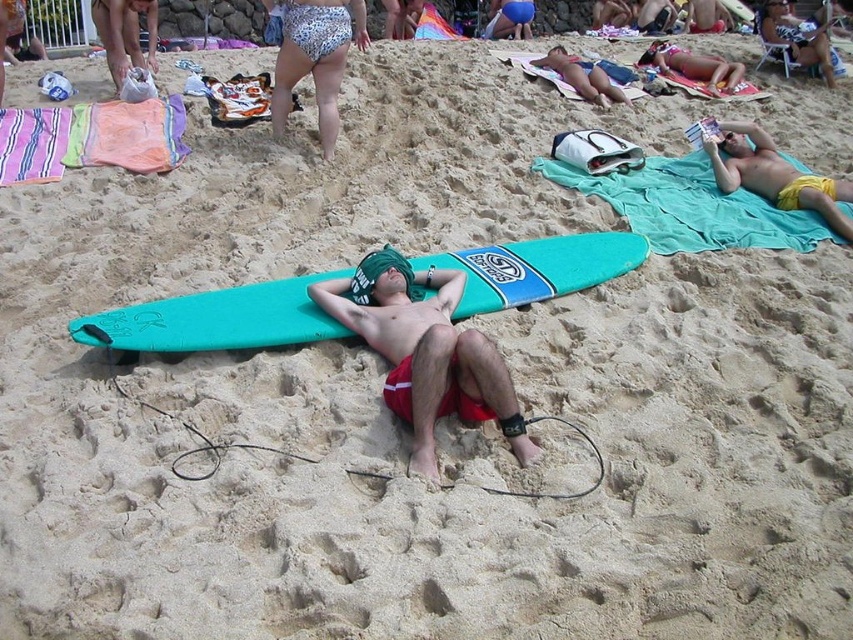
Question: Which object appears closest to the camera in this image?

Choices:
 (A) teal matte surfboard at center
 (B) yellow fabric towel at upper right
 (C) teal fabric towel at upper right
 (D) matte green towel at upper right

Answer: (A)

Question: Among these points, which one is nearest to the camera?

Choices:
 (A) (642, 202)
 (B) (556, 44)
 (C) (432, 364)

Answer: (C)

Question: Is teal fabric towel at upper right below printed fabric bikini bottom at upper center?

Choices:
 (A) no
 (B) yes

Answer: (B)

Question: Among these objects, which one is nearest to the camera?

Choices:
 (A) yellow fabric towel at upper right
 (B) matte green towel at center

Answer: (B)

Question: Can you confirm if printed fabric bikini bottom at upper center is positioned to the left of matte green towel at upper right?

Choices:
 (A) yes
 (B) no

Answer: (A)

Question: Where is yellow fabric towel at upper right located in relation to matte yellow shorts at upper right in the image?

Choices:
 (A) below
 (B) above

Answer: (B)